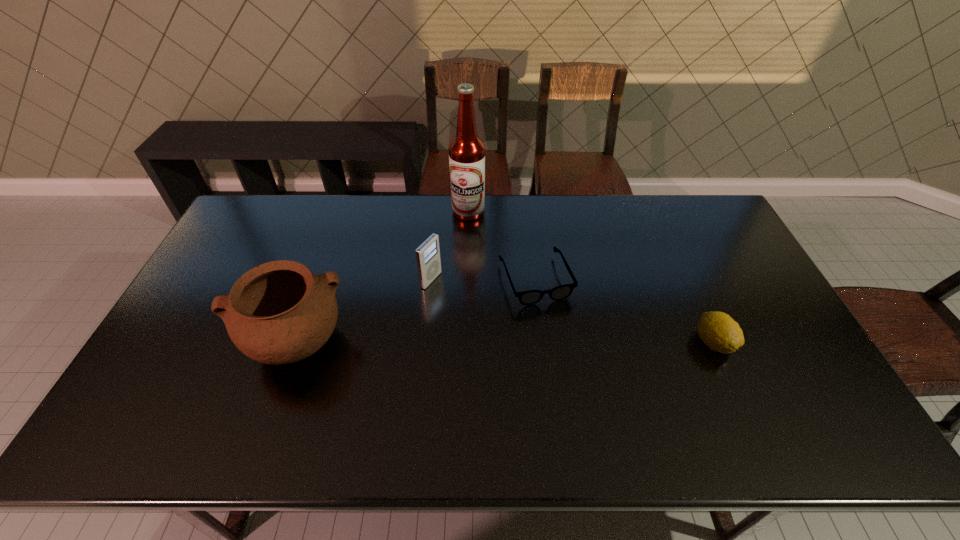
This screenshot has width=960, height=540. I want to click on blank space located 0.300m on the label side of the alcohol, so click(x=477, y=283).

Where is `object located at the far edge`? The height and width of the screenshot is (540, 960). object located at the far edge is located at coordinates (467, 153).

Image resolution: width=960 pixels, height=540 pixels. I want to click on object that is at the near edge, so click(277, 313).

In the image, there is a desktop. Where is `vacant space at the far edge`? This screenshot has height=540, width=960. vacant space at the far edge is located at coordinates (341, 206).

Find the location of a particular element. This screenshot has width=960, height=540. free space at the near edge is located at coordinates (671, 399).

You are a GUI agent. You are given a task and a screenshot of the screen. Output one action in this format:
    pyautogui.click(x=<x>, y=<y>)
    Task: Click on the free space at the left edge
    Image resolution: width=960 pixels, height=540 pixels.
    Given the screenshot: What is the action you would take?
    pyautogui.click(x=240, y=260)

The height and width of the screenshot is (540, 960). In the image, there is a desktop. Identify the location of vacant space at the right edge. [743, 276].

Locate an element on the screen. This screenshot has height=540, width=960. vacant area at the far right corner of the desktop is located at coordinates (699, 217).

Locate an element on the screen. The width and height of the screenshot is (960, 540). vacant space that is in between the spectacles and the leftmost object is located at coordinates [415, 311].

At what (x,y) coordinates should I click in order to perform the action: click on free space between the third tallest object and the pottery. Please return your answer as a coordinate pair (x, y). The image size is (960, 540). Looking at the image, I should click on (363, 311).